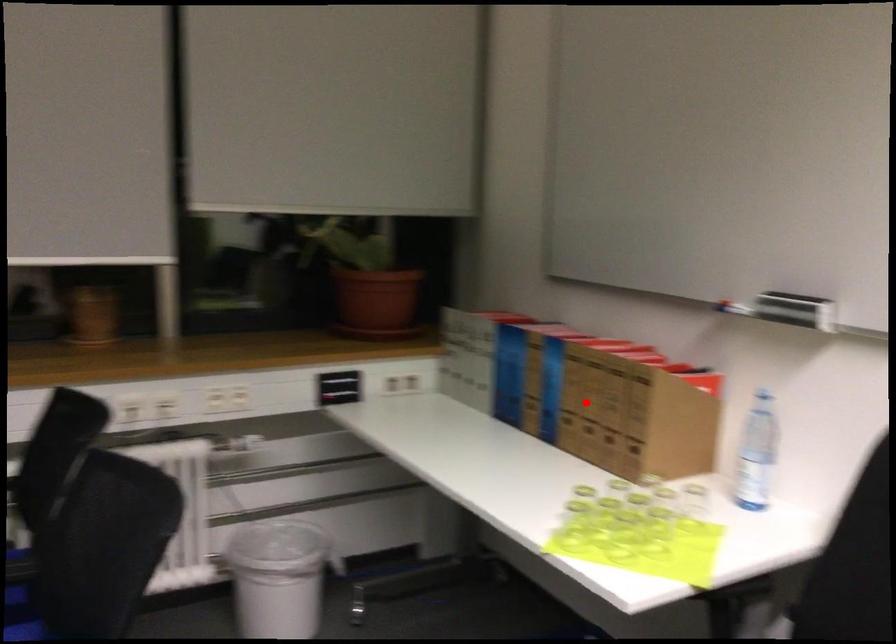
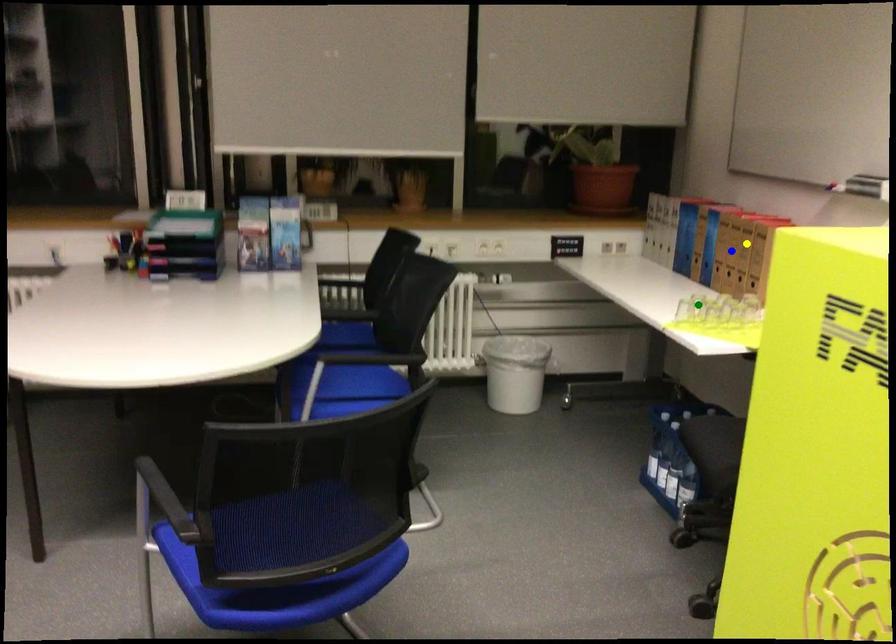
Question: I am providing you with two images of the same scene from different viewpoints. A red point is marked on the first image. You are given multiple points on the second image. In image 2, which mark is for the same physical point as the one in image 1?

Choices:
 (A) yellow point
 (B) blue point
 (C) green point

Answer: (B)